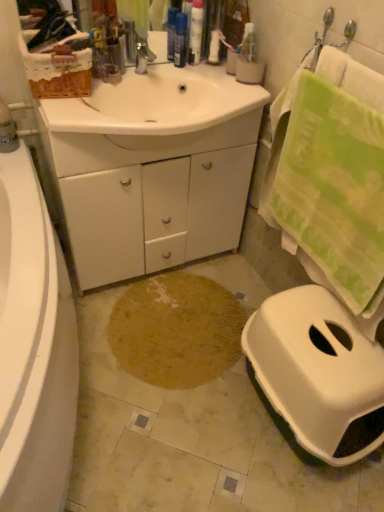
Locate an element on the screen. free space in front of white glossy tube at upper center, which is counted as the 2th toiletry, starting from the left is located at coordinates (178, 91).